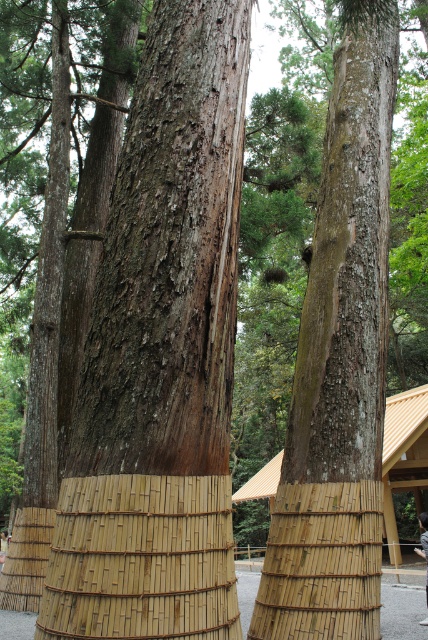
Question: Does brown rough bark tree trunk at center appear on the left side of bamboo mat at center?

Choices:
 (A) no
 (B) yes

Answer: (B)

Question: Which point is closer to the camera taking this photo?

Choices:
 (A) (369, 461)
 (B) (407, 429)
 (C) (80, 492)

Answer: (C)

Question: Does brown rough bark tree trunk at center lie in front of bamboo mat at center?

Choices:
 (A) yes
 (B) no

Answer: (A)

Question: Does brown rough bark tree trunk at center appear over bamboo mat at center?

Choices:
 (A) no
 (B) yes

Answer: (B)

Question: Among these objects, which one is farthest from the camera?

Choices:
 (A) bamboo mat at center
 (B) brown rough bark tree trunk at center

Answer: (A)

Question: Which point appears farthest from the camera in this image?

Choices:
 (A) click(222, 156)
 (B) click(369, 298)
 (C) click(386, 451)

Answer: (C)